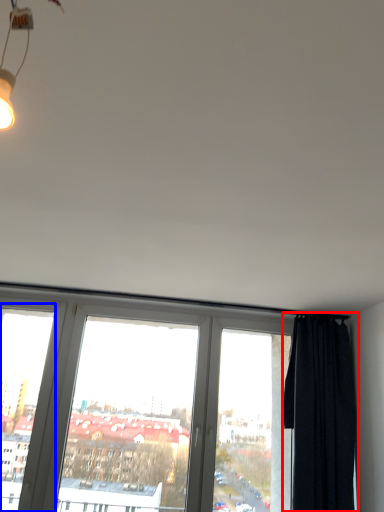
Question: Which object is further to the camera taking this photo, curtain (highlighted by a red box) or window frame (highlighted by a blue box)?

Choices:
 (A) curtain
 (B) window frame

Answer: (B)